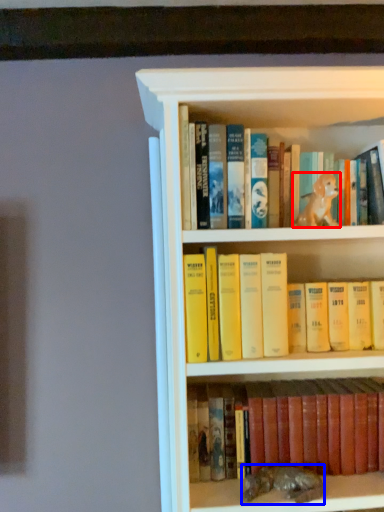
Question: Among these objects, which one is nearest to the camera, animal (highlighted by a red box) or animal (highlighted by a blue box)?

Choices:
 (A) animal
 (B) animal

Answer: (A)